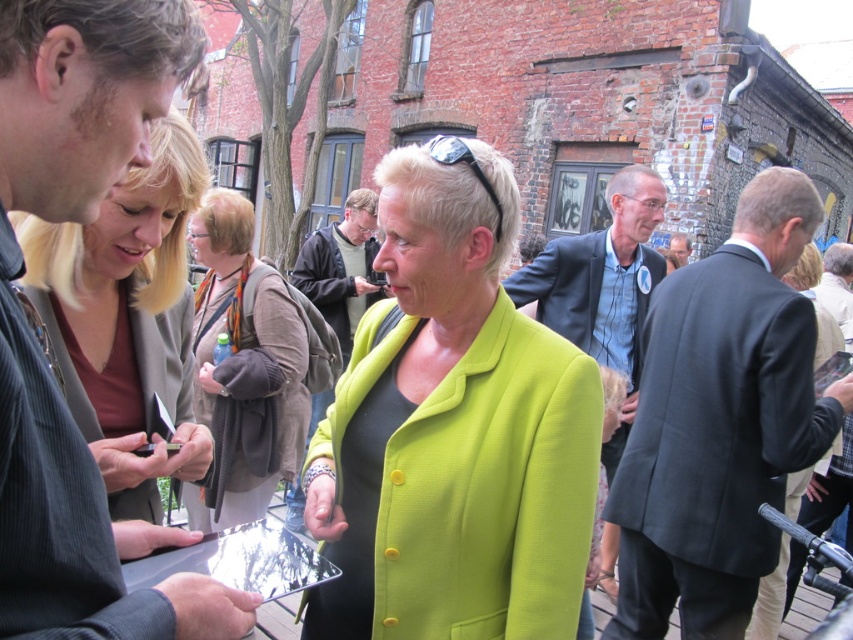
You are organizing a photo shoot and need to ensure that the dark blue suit at right and the brown textured scarf at center are visible in the frame. Given their sizes, which object might require more space to accommodate its size?

The dark blue suit at right is bigger than the brown textured scarf at center, so it would require more space to accommodate its size.

You are standing in the outdoor scene and want to walk from point (257, 301) to point (730, 388). Which point will you reach first?

You will reach point (730, 388) first because it is closer to the viewer than point (257, 301).

Looking at this image, you are a fashion designer observing the scene and want to create a new collection based on the outfits. Which item, the matte brown leather jacket at upper left or the brown textured scarf at center, would require less fabric to produce?

The matte brown leather jacket at upper left requires less fabric than the brown textured scarf at center because it is thinner.